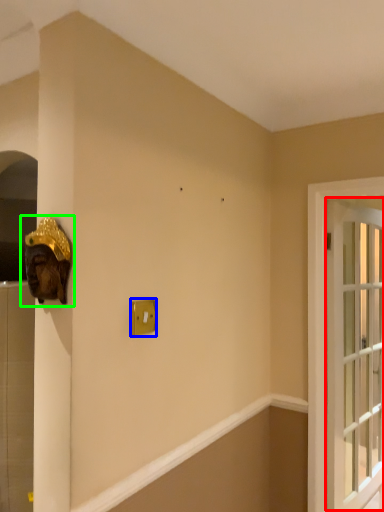
Question: Considering the real-world distances, which object is closest to window (highlighted by a red box)? light switch (highlighted by a blue box) or sculpture (highlighted by a green box).

Choices:
 (A) light switch
 (B) sculpture

Answer: (A)